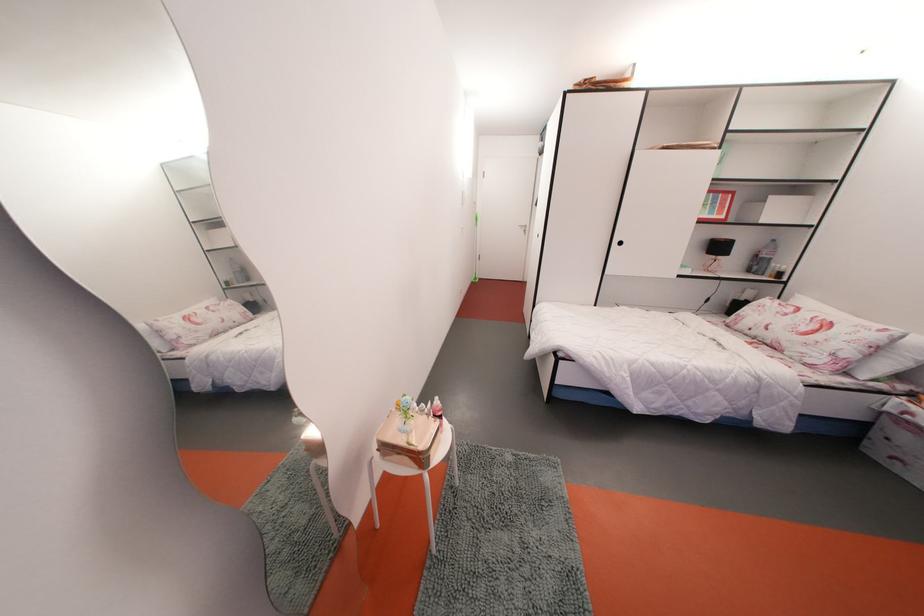
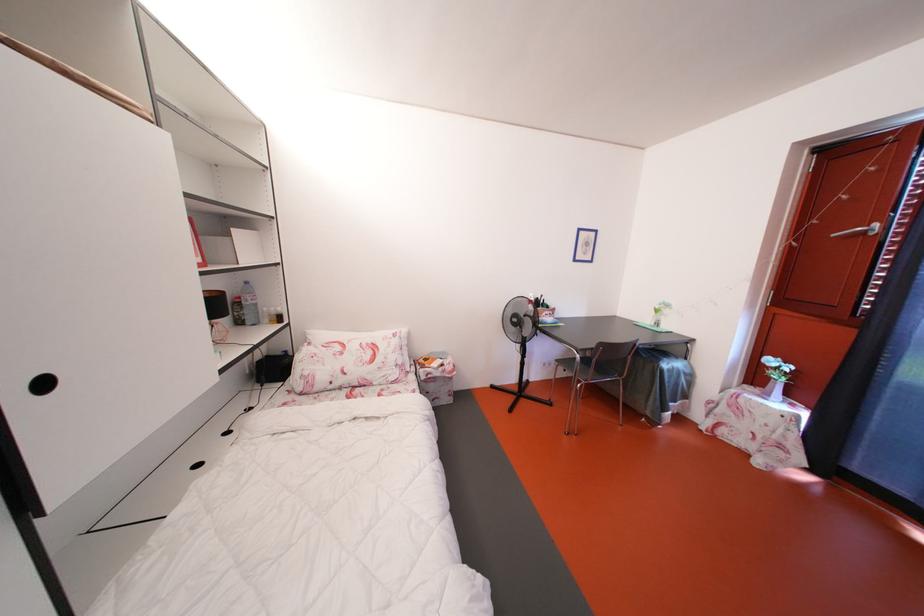
Locate, in the second image, the point that corresponds to the point at 627,249 in the first image.

(52, 390)